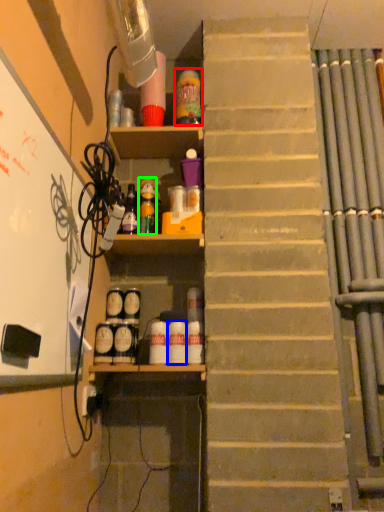
Question: Which object is the farthest from bottle (highlighted by a red box)? Choose among these: bottle (highlighted by a blue box) or bottle (highlighted by a green box).

Choices:
 (A) bottle
 (B) bottle

Answer: (A)